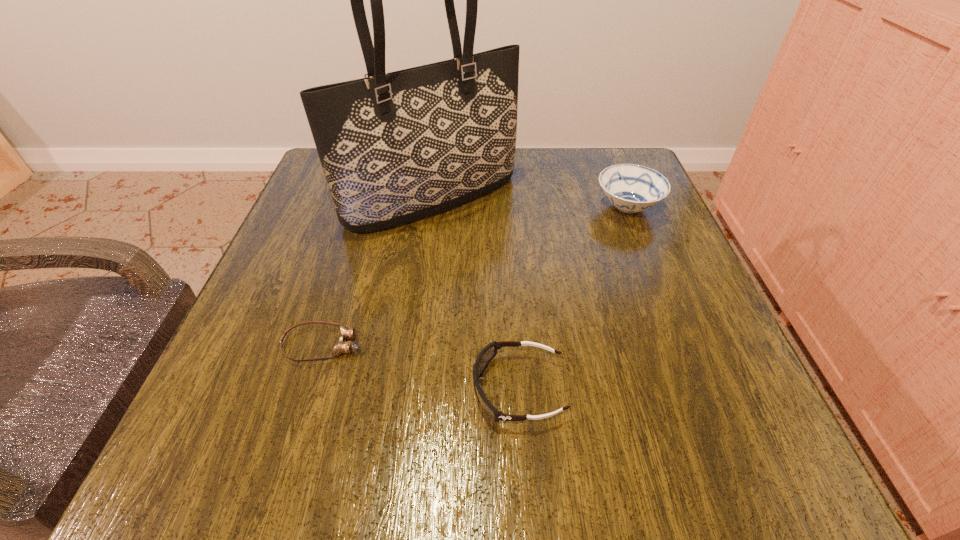
I want to click on object located in the far right corner section of the desktop, so click(x=631, y=188).

In the image, there is a desktop. Find the location of `blank space at the far edge`. blank space at the far edge is located at coordinates (555, 201).

At what (x,y) coordinates should I click in order to perform the action: click on vacant space at the near edge of the desktop. Please return your answer as a coordinate pair (x, y). Looking at the image, I should click on (433, 424).

Find the location of a particular element. vacant region at the left edge of the desktop is located at coordinates (284, 285).

Identify the location of free space at the right edge of the desktop. (593, 220).

In the image, there is a desktop. Identify the location of free space at the far right corner. (595, 182).

I want to click on empty space between the left goggles and the rightmost object, so click(475, 276).

Locate an element on the screen. This screenshot has width=960, height=540. free area in between the shortest object and the tote bag is located at coordinates (377, 272).

Locate an element on the screen. free spot between the rightmost object and the taller goggles is located at coordinates tap(573, 298).

Identify the location of empty space between the shortest object and the rightmost object. (475, 276).